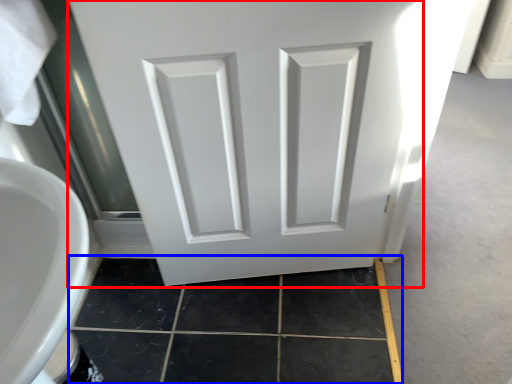
Question: Which object is closer to the camera taking this photo, door (highlighted by a red box) or tile (highlighted by a blue box)?

Choices:
 (A) door
 (B) tile

Answer: (A)